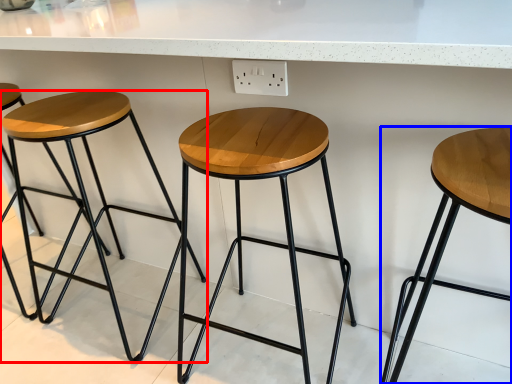
Question: Which of the following is the farthest to the observer, stool (highlighted by a red box) or stool (highlighted by a blue box)?

Choices:
 (A) stool
 (B) stool

Answer: (A)